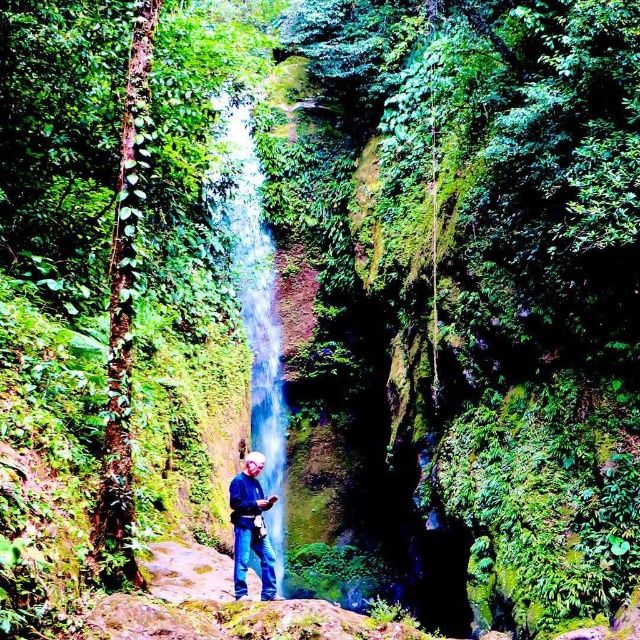
Is translucent glass waterfall at center thinner than blue jeans at lower center?

In fact, translucent glass waterfall at center might be wider than blue jeans at lower center.

The image size is (640, 640). What do you see at coordinates (253, 300) in the screenshot? I see `translucent glass waterfall at center` at bounding box center [253, 300].

The image size is (640, 640). What are the coordinates of `translucent glass waterfall at center` in the screenshot? It's located at (253, 300).